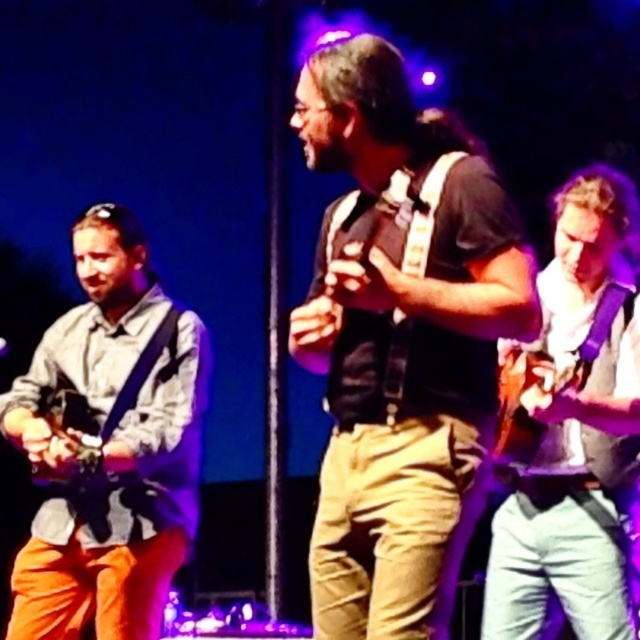
You are a stagehand who needs to place a 1.2 meter wide backdrop behind the performers. The backdrop must be centered between the matte black vest at center and the white matte guitar at right. Given the width difference between the two, will the backdrop fit perfectly without overlapping either performer?

The matte black vest at center is wider than the white matte guitar at right. Since the backdrop is 1.2 meters wide and needs to be centered between them, the width difference may cause the backdrop to extend beyond one or both performers. However, without exact measurements of their positions and distances, it is impossible to determine if it will fit perfectly without overlapping.

You are a photographer in the audience taking pictures of the performers. You notice the matte black vest at center and the light gray fabric shirt at left. Which one appears larger in your photo?

The matte black vest at center appears larger in the photo because it is closer to the viewer than the light gray fabric shirt at left.